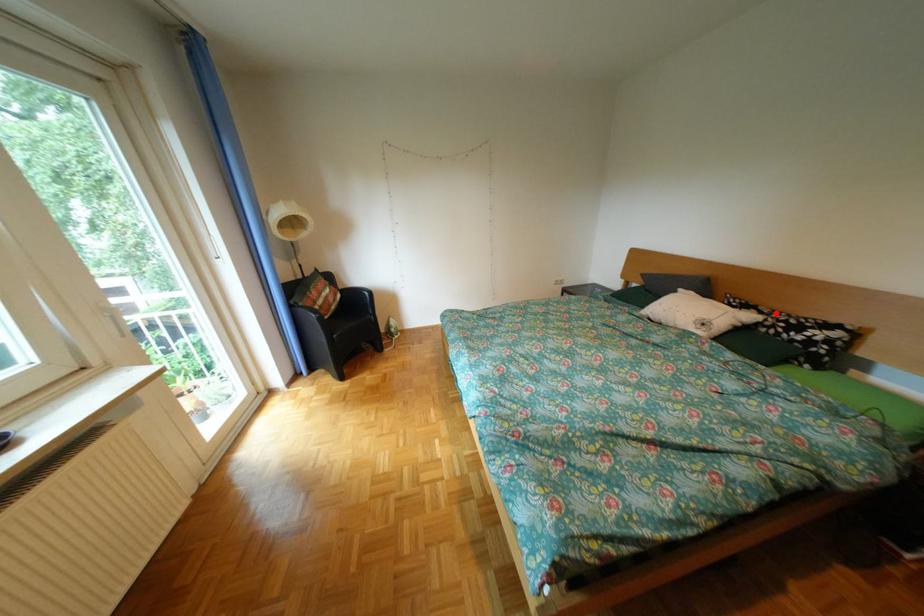
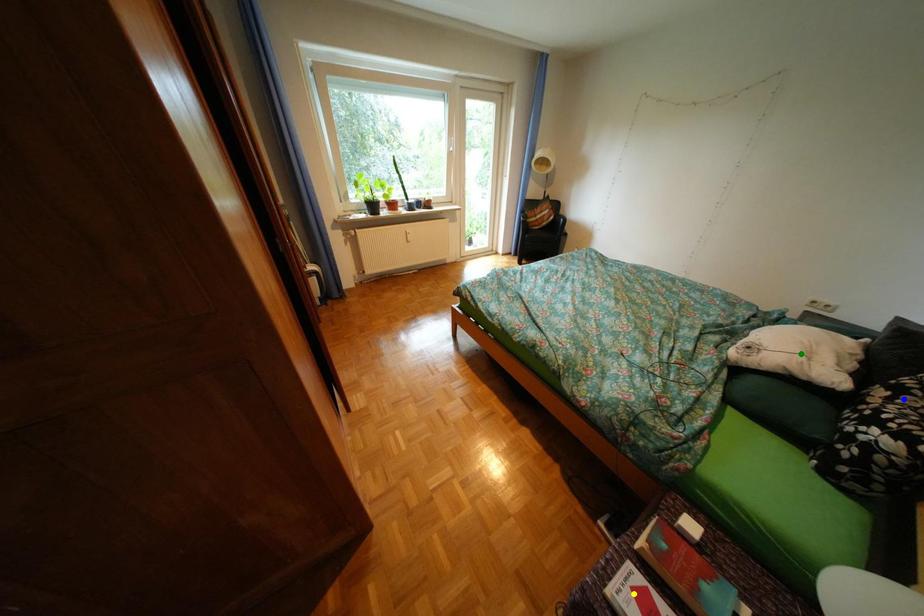
Question: I am providing you with two images of the same scene from different viewpoints. A red point is marked on the first image. You are given multiple points on the second image. Can you choose the point in image 2 that corresponds to the point in image 1?

Choices:
 (A) blue point
 (B) green point
 (C) yellow point

Answer: (A)